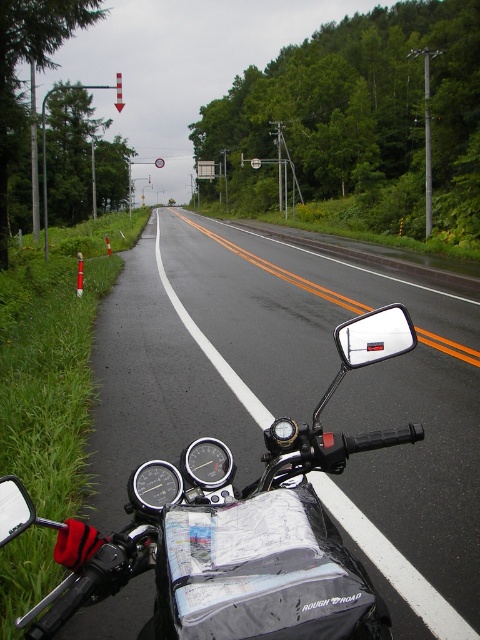
Between point (204, 483) and point (396, 317), which one is positioned in front?

Positioned in front is point (204, 483).

Which of these two, black matte motorcycle at center or clear plastic mirror at center, stands shorter?

clear plastic mirror at center

This screenshot has height=640, width=480. Describe the element at coordinates (223, 544) in the screenshot. I see `black matte motorcycle at center` at that location.

This screenshot has height=640, width=480. Find the location of `black matte motorcycle at center`. black matte motorcycle at center is located at coordinates (223, 544).